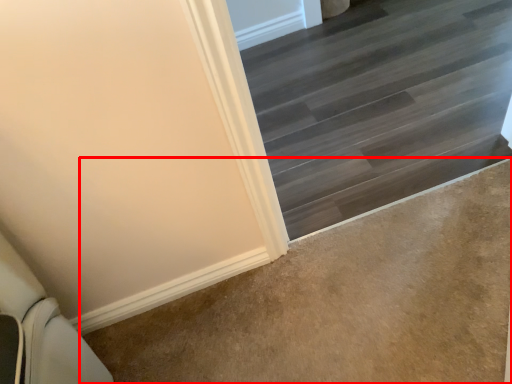
Question: In this image, where is concrete (annotated by the red box) located relative to stairs?

Choices:
 (A) right
 (B) left

Answer: (B)